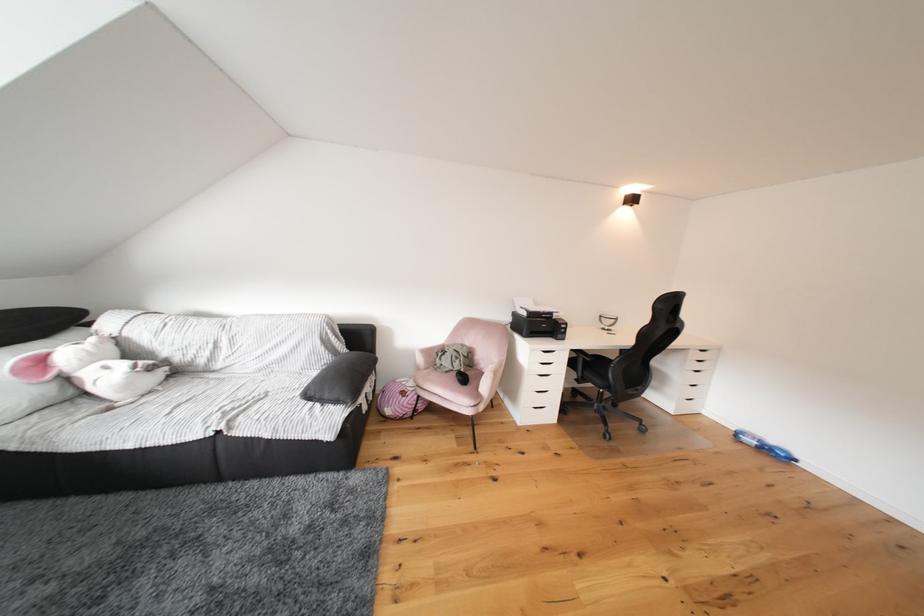
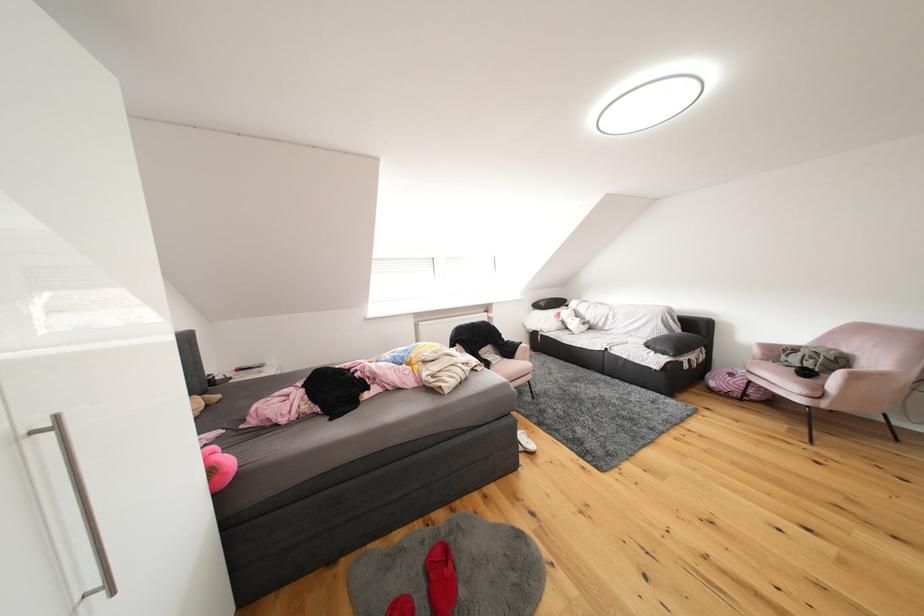
The point at [490,411] is marked in the first image. Where is the corresponding point in the second image?

(834, 408)